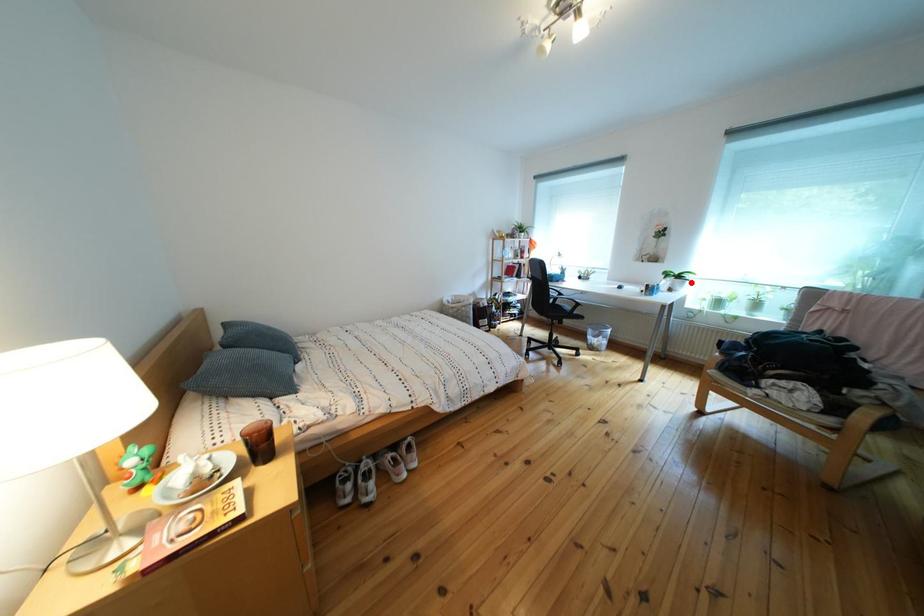
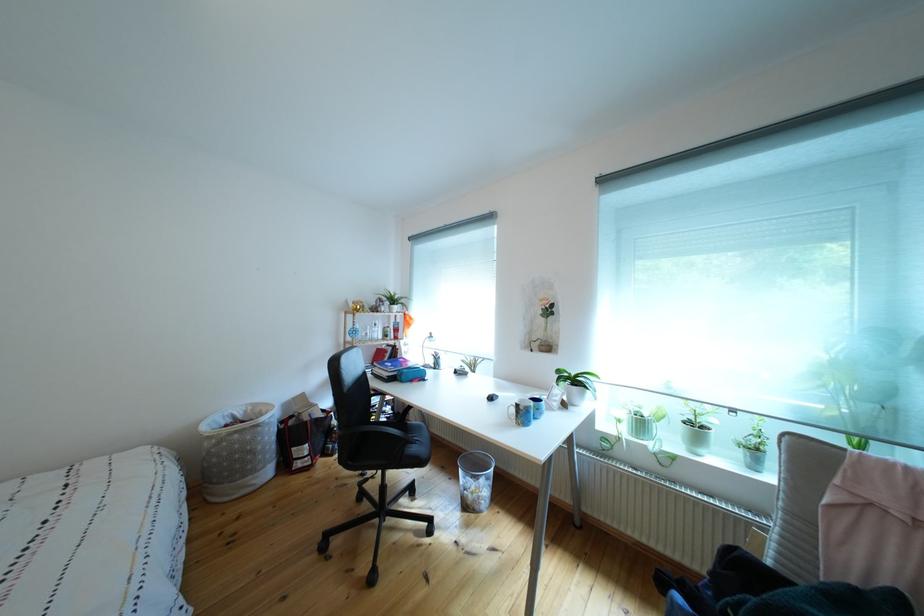
Question: I am providing you with two images of the same scene from different viewpoints. In image1, a red point is highlighted. Considering the same 3D point in image2, which of the following is correct?

Choices:
 (A) It is closer
 (B) It is farther

Answer: (B)